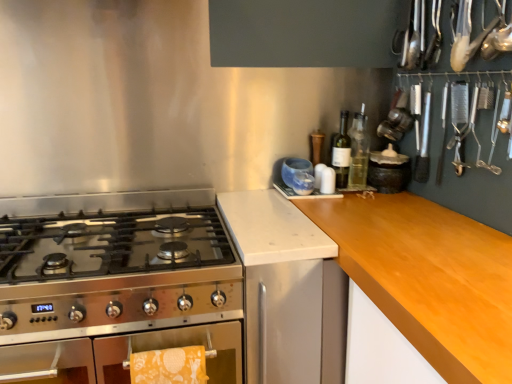
Question: In terms of height, does clear glass bottle at upper right, the 2th bottle in the left-to-right sequence, look taller or shorter compared to green glass bottle at upper right, which appears as the 1th bottle when viewed from the left?

Choices:
 (A) short
 (B) tall

Answer: (B)

Question: Is clear glass bottle at upper right, marked as the first bottle in a right-to-left arrangement, wider or thinner than green glass bottle at upper right, the second bottle positioned from the right?

Choices:
 (A) thin
 (B) wide

Answer: (B)

Question: Which of these objects is positioned farthest from the green glass bottle at upper right, which appears as the 1th bottle when viewed from the left?

Choices:
 (A) yellow printed towel at lower left
 (B) clear glass bottle at upper right, marked as the first bottle in a right-to-left arrangement
 (C) stainless steel gas stove at left
 (D) matte black jar at upper right

Answer: (A)

Question: Which is nearer to the green glass bottle at upper right, which appears as the 1th bottle when viewed from the left?

Choices:
 (A) matte black jar at upper right
 (B) stainless steel gas stove at left
 (C) yellow printed towel at lower left
 (D) clear glass bottle at upper right, the 2th bottle in the left-to-right sequence

Answer: (D)